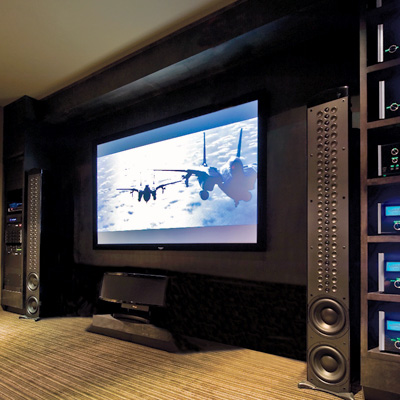
You are a GUI agent. You are given a task and a screenshot of the screen. Output one action in this format:
    pyautogui.click(x=<x>, y=<y>)
    Task: Click on the monitor
    
    Given the screenshot: What is the action you would take?
    point(166,170)